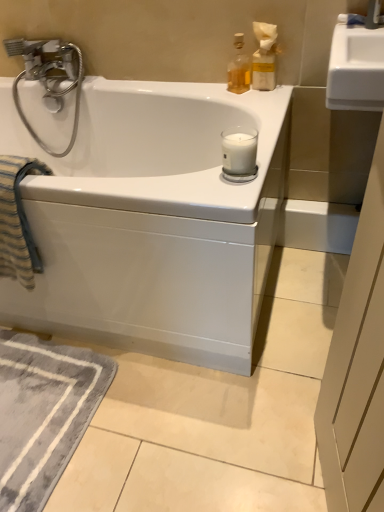
Question: Is translucent glass bottle at upper right, which is the first bottle from right to left, thinner than white matte glass candle at upper right?

Choices:
 (A) no
 (B) yes

Answer: (B)

Question: Is translucent glass bottle at upper right, which is the first bottle from right to left, bigger than white matte glass candle at upper right?

Choices:
 (A) no
 (B) yes

Answer: (B)

Question: Is the depth of translucent glass bottle at upper right, the 2th bottle in the left-to-right sequence, greater than that of white matte glass candle at upper right?

Choices:
 (A) yes
 (B) no

Answer: (A)

Question: From the image's perspective, does translucent glass bottle at upper right, the 2th bottle in the left-to-right sequence, appear lower than white matte glass candle at upper right?

Choices:
 (A) no
 (B) yes

Answer: (A)

Question: From a real-world perspective, is translucent glass bottle at upper right, the 2th bottle in the left-to-right sequence, over white matte glass candle at upper right?

Choices:
 (A) yes
 (B) no

Answer: (A)

Question: Considering the relative positions of translucent glass bottle at upper right, the 2th bottle in the left-to-right sequence, and white glossy bathtub at center in the image provided, is translucent glass bottle at upper right, the 2th bottle in the left-to-right sequence, to the left or to the right of white glossy bathtub at center?

Choices:
 (A) left
 (B) right

Answer: (B)

Question: From the image's perspective, is translucent glass bottle at upper right, the 2th bottle in the left-to-right sequence, positioned above or below white glossy bathtub at center?

Choices:
 (A) below
 (B) above

Answer: (B)

Question: Is translucent glass bottle at upper right, which is the first bottle from right to left, taller or shorter than white glossy bathtub at center?

Choices:
 (A) short
 (B) tall

Answer: (A)

Question: In terms of width, does translucent glass bottle at upper right, which is the first bottle from right to left, look wider or thinner when compared to white glossy bathtub at center?

Choices:
 (A) wide
 (B) thin

Answer: (B)

Question: Looking at their shapes, would you say translucent glass bottle at upper right, the 2th bottle in the left-to-right sequence, is wider or thinner than translucent glass bottle at upper right, arranged as the 2th bottle when viewed from the right?

Choices:
 (A) wide
 (B) thin

Answer: (A)

Question: From the image's perspective, relative to translucent glass bottle at upper right, arranged as the 2th bottle when viewed from the right, is translucent glass bottle at upper right, the 2th bottle in the left-to-right sequence, above or below?

Choices:
 (A) above
 (B) below

Answer: (A)

Question: Relative to translucent glass bottle at upper right, acting as the first bottle starting from the left, is translucent glass bottle at upper right, which is the first bottle from right to left, in front or behind?

Choices:
 (A) behind
 (B) front

Answer: (B)

Question: Which is correct: translucent glass bottle at upper right, which is the first bottle from right to left, is inside translucent glass bottle at upper right, acting as the first bottle starting from the left, or outside of it?

Choices:
 (A) outside
 (B) inside

Answer: (A)

Question: In the image, is gray soft rug at lower left positioned in front of or behind striped cotton beach towel at left?

Choices:
 (A) behind
 (B) front

Answer: (A)

Question: Considering the positions of gray soft rug at lower left and striped cotton beach towel at left in the image, is gray soft rug at lower left taller or shorter than striped cotton beach towel at left?

Choices:
 (A) short
 (B) tall

Answer: (A)